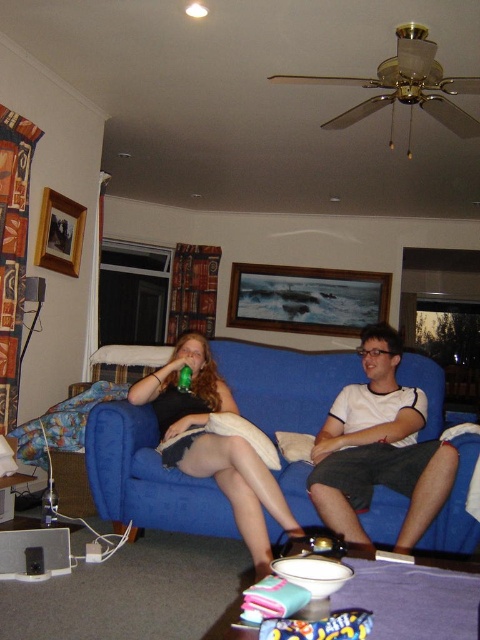
Question: Can you confirm if white cotton t-shirt at center is bigger than matte black dress at center?

Choices:
 (A) no
 (B) yes

Answer: (A)

Question: Is white cotton t-shirt at center in front of matte black dress at center?

Choices:
 (A) no
 (B) yes

Answer: (A)

Question: Which of the following is the closest to the observer?

Choices:
 (A) blue fabric couch at center
 (B) white cotton t-shirt at center
 (C) matte black dress at center

Answer: (C)

Question: Which of these objects is positioned farthest from the matte black dress at center?

Choices:
 (A) blue fabric couch at center
 (B) white cotton t-shirt at center

Answer: (B)

Question: Is blue fabric couch at center in front of matte black dress at center?

Choices:
 (A) no
 (B) yes

Answer: (A)

Question: Among these points, which one is nearest to the camera?

Choices:
 (A) (271, 483)
 (B) (228, 342)
 (C) (323, 451)

Answer: (A)